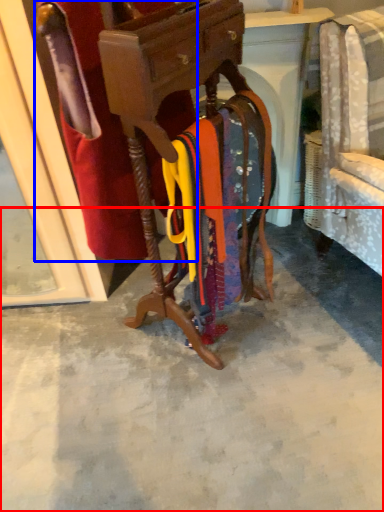
Question: Which object is closer to the camera taking this photo, concrete (highlighted by a red box) or robe (highlighted by a blue box)?

Choices:
 (A) concrete
 (B) robe

Answer: (B)